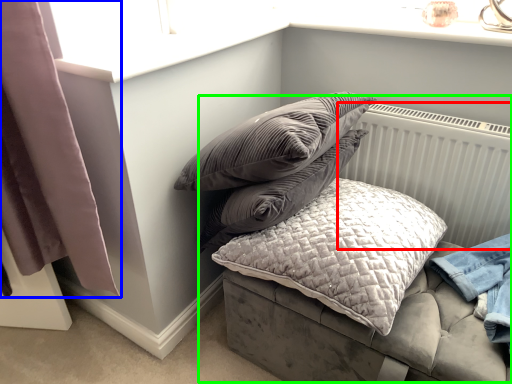
Question: Based on their relative distances, which object is nearer to radiator (highlighted by a red box)? Choose from curtain (highlighted by a blue box) and bed (highlighted by a green box).

Choices:
 (A) curtain
 (B) bed

Answer: (B)